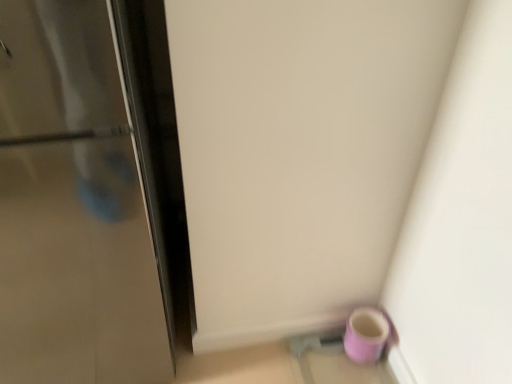
Question: From the image's perspective, relative to matte purple mug at lower right, is glossy metallic door at left above or below?

Choices:
 (A) above
 (B) below

Answer: (A)

Question: In terms of size, does glossy metallic door at left appear bigger or smaller than matte purple mug at lower right?

Choices:
 (A) small
 (B) big

Answer: (B)

Question: Based on their positions, is glossy metallic door at left located to the left or right of matte purple mug at lower right?

Choices:
 (A) right
 (B) left

Answer: (B)

Question: Is matte purple mug at lower right taller or shorter than glossy metallic door at left?

Choices:
 (A) short
 (B) tall

Answer: (A)

Question: Based on their sizes in the image, would you say matte purple mug at lower right is bigger or smaller than glossy metallic door at left?

Choices:
 (A) big
 (B) small

Answer: (B)

Question: From the image's perspective, is matte purple mug at lower right above or below glossy metallic door at left?

Choices:
 (A) above
 (B) below

Answer: (B)

Question: Is matte purple mug at lower right inside the boundaries of glossy metallic door at left, or outside?

Choices:
 (A) inside
 (B) outside

Answer: (B)